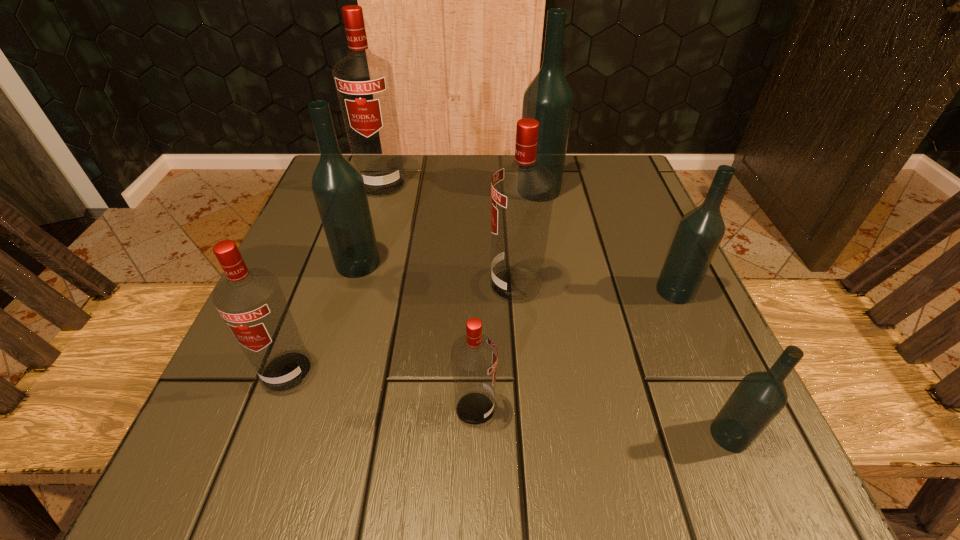
I want to click on the farthest red vodka, so click(x=364, y=83).

Where is `the biggest black vodka`? The image size is (960, 540). the biggest black vodka is located at coordinates (548, 99).

I want to click on the second black vodka from left to right, so click(x=548, y=99).

The width and height of the screenshot is (960, 540). Find the location of `the second farthest red vodka`. the second farthest red vodka is located at coordinates (522, 193).

At what (x,y) coordinates should I click in order to perform the action: click on the second biggest black vodka. Please return your answer as a coordinate pair (x, y). The image size is (960, 540). Looking at the image, I should click on (338, 186).

Find the location of a particular element. the second smallest black vodka is located at coordinates (699, 234).

You are a GUI agent. You are given a task and a screenshot of the screen. Output one action in this format:
    pyautogui.click(x=<x>, y=<y>)
    Task: Click on the second smallest red vodka
    
    Given the screenshot: What is the action you would take?
    pyautogui.click(x=251, y=302)

The height and width of the screenshot is (540, 960). In order to click on the smallest red vodka in this screenshot , I will do `click(474, 356)`.

At what (x,y) coordinates should I click in order to perform the action: click on the smallest black vodka. Please return your answer as a coordinate pair (x, y). The image size is (960, 540). Looking at the image, I should click on (760, 396).

You are a GUI agent. You are given a task and a screenshot of the screen. Output one action in this format:
    pyautogui.click(x=<x>, y=<y>)
    Task: Click on the vacant space located 0.400m on the front label of the farthest red vodka
    The image size is (960, 540).
    Given the screenshot: What is the action you would take?
    pyautogui.click(x=335, y=344)